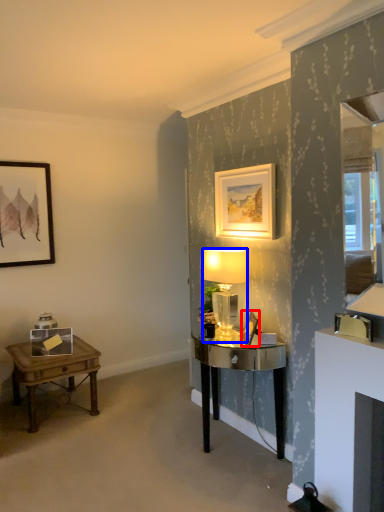
Question: Which object appears farthest to the camera in this image, picture frame (highlighted by a red box) or lamp (highlighted by a blue box)?

Choices:
 (A) picture frame
 (B) lamp

Answer: (B)